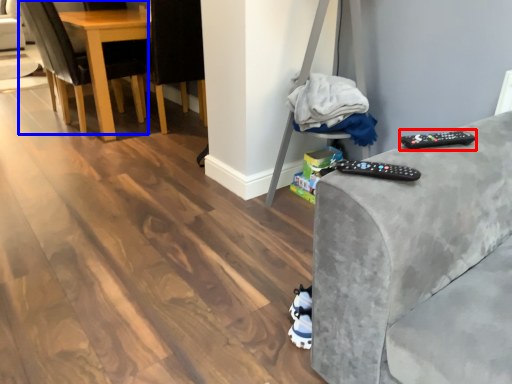
Question: Which of the following is the farthest to the observer, remote (highlighted by a red box) or chair (highlighted by a blue box)?

Choices:
 (A) remote
 (B) chair

Answer: (B)